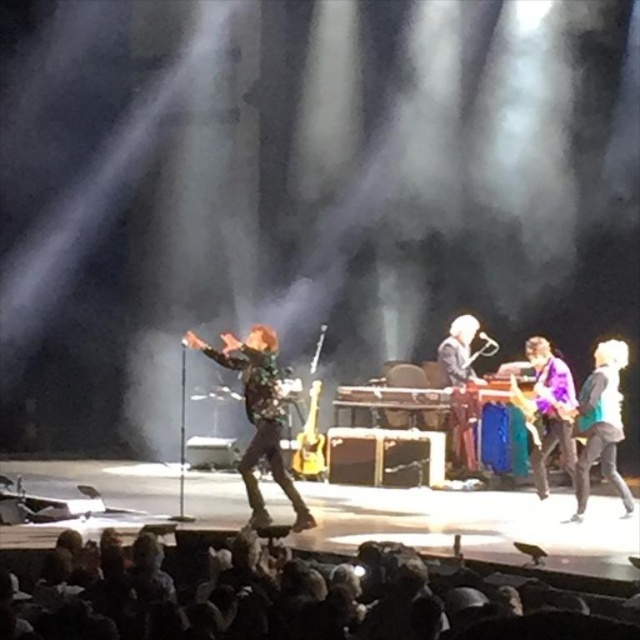
You are a photographer positioned at the front of the stage. You want to capture a photo that includes both the teal fabric jacket at right and the purple glossy guitar at right. Which object should you position closer to the left side of your camera frame to ensure both are in the shot?

You should position the purple glossy guitar at right closer to the left side of your camera frame because the teal fabric jacket at right is to the right of the purple glossy guitar at right, so moving the guitar leftward would allow both objects to fit within the frame.

You are a photographer at the concert. You want to capture a photo that includes both the teal fabric jacket at right and the purple glossy guitar at right. Which object should you frame first in your camera to ensure both fit in the shot?

The teal fabric jacket at right is wider than the purple glossy guitar at right, so you should frame the teal fabric jacket at right first to ensure both fit in the shot.

You are a photographer at the concert and want to capture a closeup shot of the purple glossy guitar at right and the shiny silver guitar at center. Which guitar should you focus on to ensure it appears larger in your photo?

The purple glossy guitar at right is closer to the viewer than the shiny silver guitar at center, so focusing on it will make it appear larger in the photo.